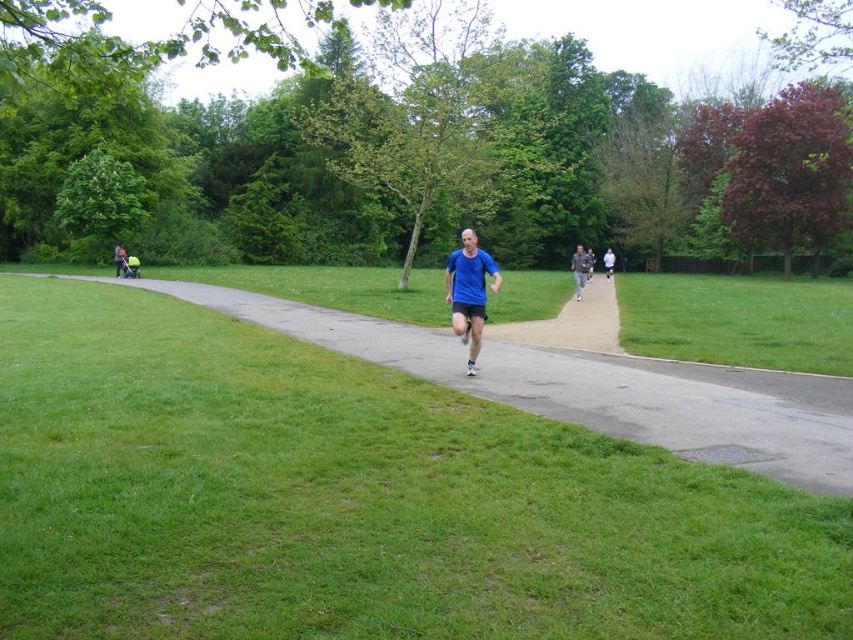
Question: Can you confirm if green grass at lower right is thinner than matte black stroller at left?

Choices:
 (A) yes
 (B) no

Answer: (B)

Question: Which object is farther from the camera taking this photo?

Choices:
 (A) green grass at lower left
 (B) blue fabric shirt at center
 (C) green grass at lower right
 (D) dark gray jacket at center

Answer: (B)

Question: Which of the following is the farthest from the observer?

Choices:
 (A) blue matte shirt at center
 (B) blue fabric shirt at center
 (C) matte black stroller at left
 (D) blue t-shirt at center

Answer: (D)

Question: Is blue matte shirt at center to the right of blue t-shirt at center from the viewer's perspective?

Choices:
 (A) no
 (B) yes

Answer: (A)

Question: Which of the following is the farthest from the observer?

Choices:
 (A) (788, 406)
 (B) (590, 252)
 (C) (712, 276)

Answer: (C)

Question: Is dark gray jacket at center above matte black stroller at left?

Choices:
 (A) yes
 (B) no

Answer: (A)